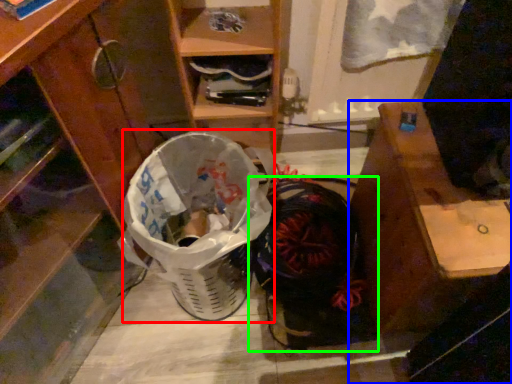
Question: Which object is positioned closest to shopping basket (highlighted by a red box)? Select from desk (highlighted by a blue box) and footwear (highlighted by a green box).

Choices:
 (A) desk
 (B) footwear

Answer: (B)